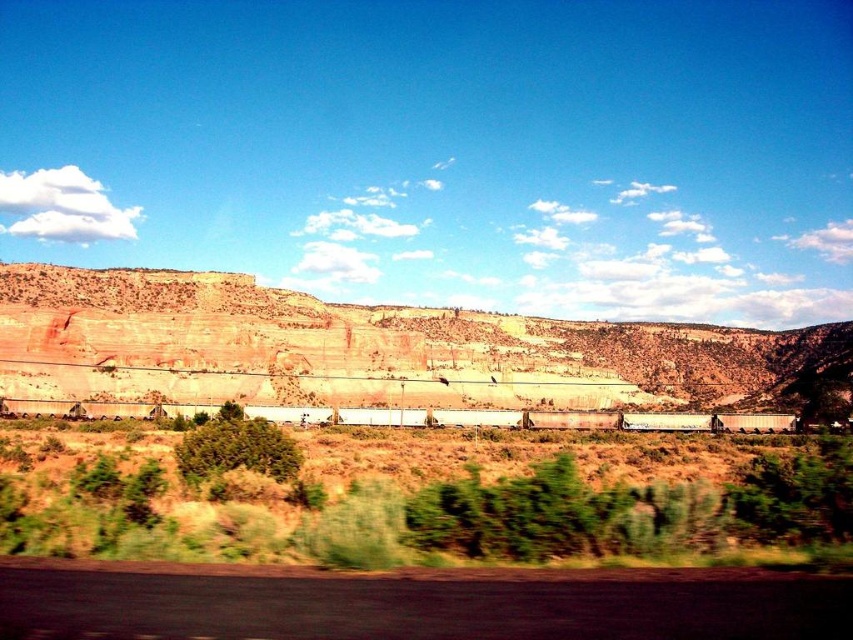
Between brown grassland at center and rustic stone cliff at center, which one is positioned lower?

brown grassland at center is lower down.

Which is more to the right, brown grassland at center or rustic stone cliff at center?

rustic stone cliff at center

Identify the location of brown grassland at center. The height and width of the screenshot is (640, 853). (433, 497).

The width and height of the screenshot is (853, 640). I want to click on brown grassland at center, so pyautogui.click(x=433, y=497).